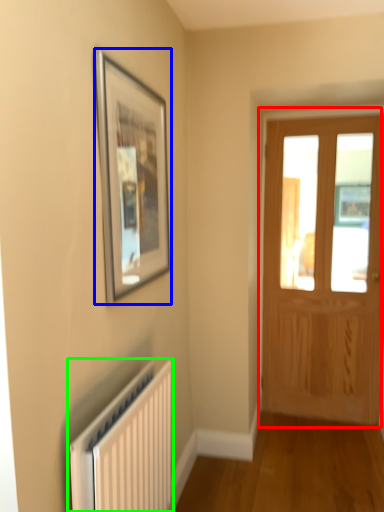
Question: Based on their relative distances, which object is nearer to door (highlighted by a red box)? Choose from picture frame (highlighted by a blue box) and radiator (highlighted by a green box).

Choices:
 (A) picture frame
 (B) radiator

Answer: (A)